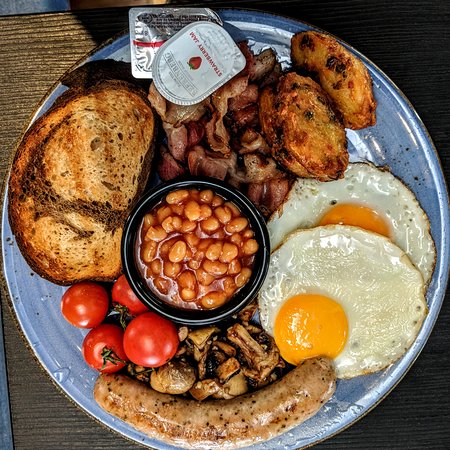
The width and height of the screenshot is (450, 450). I want to click on bowl, so click(259, 261).